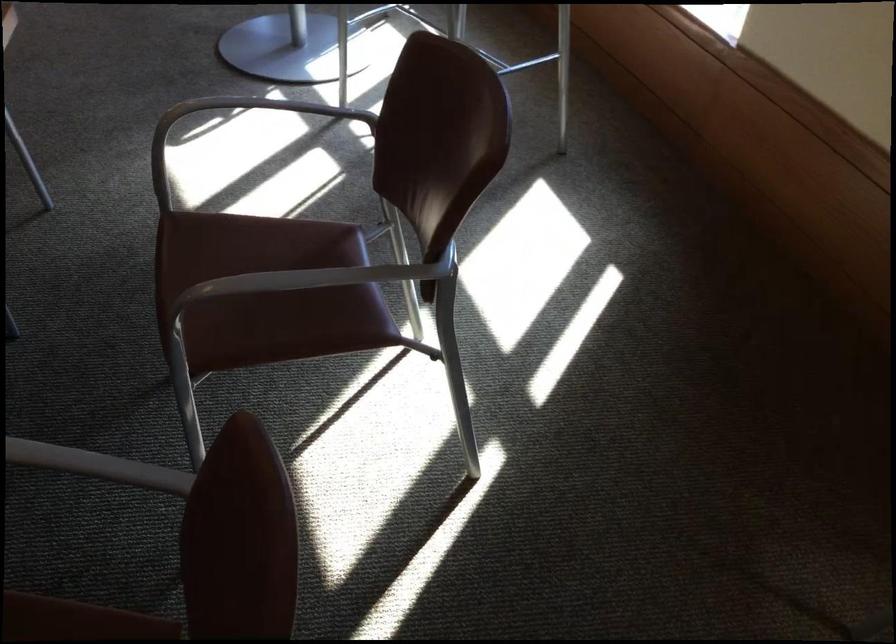
This screenshot has width=896, height=644. Describe the element at coordinates (264, 290) in the screenshot. I see `the brown chair sitting surface` at that location.